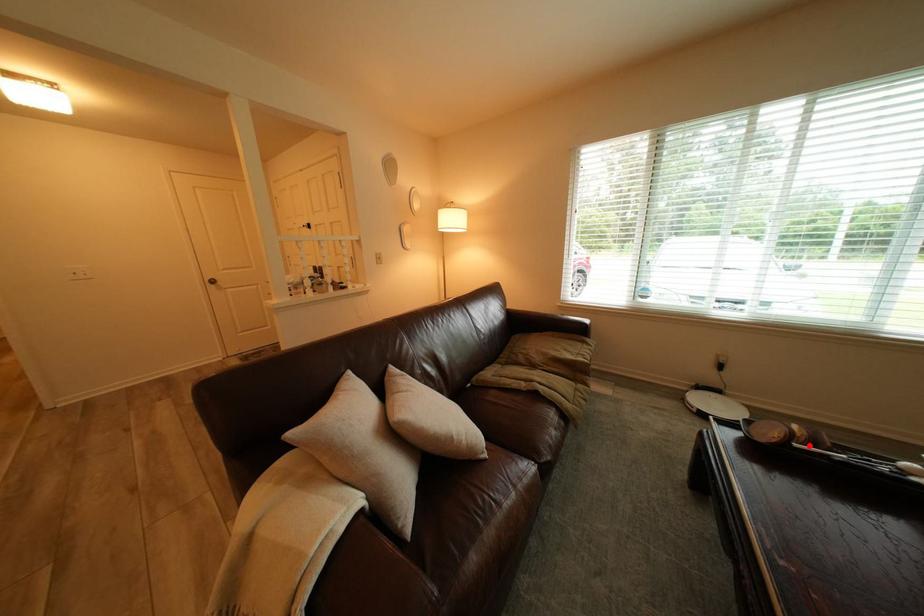
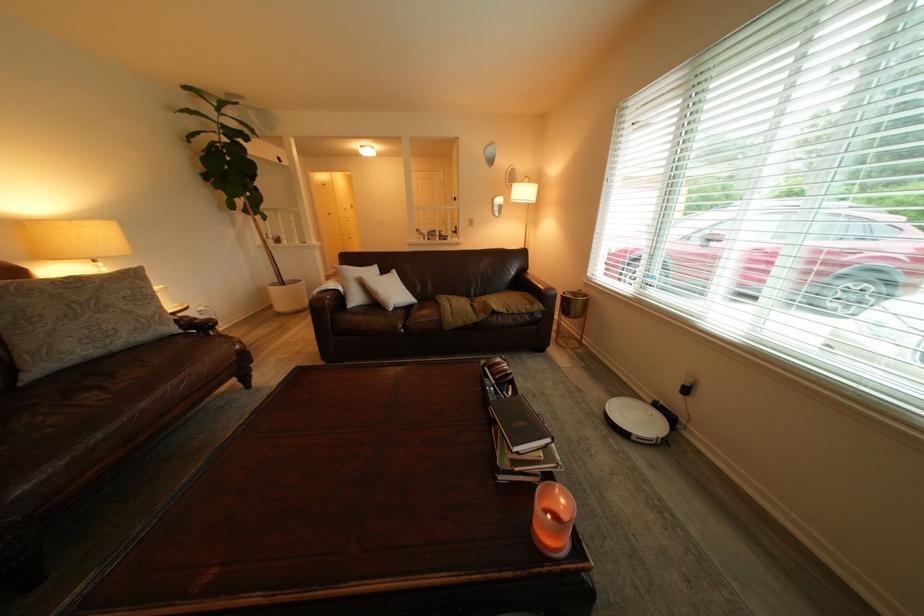
Question: A red point is marked in image1. In image2, is the corresponding 3D point closer to the camera or farther? Reply with the corresponding letter.

Choices:
 (A) The corresponding 3D point is closer.
 (B) The corresponding 3D point is farther.

Answer: (B)